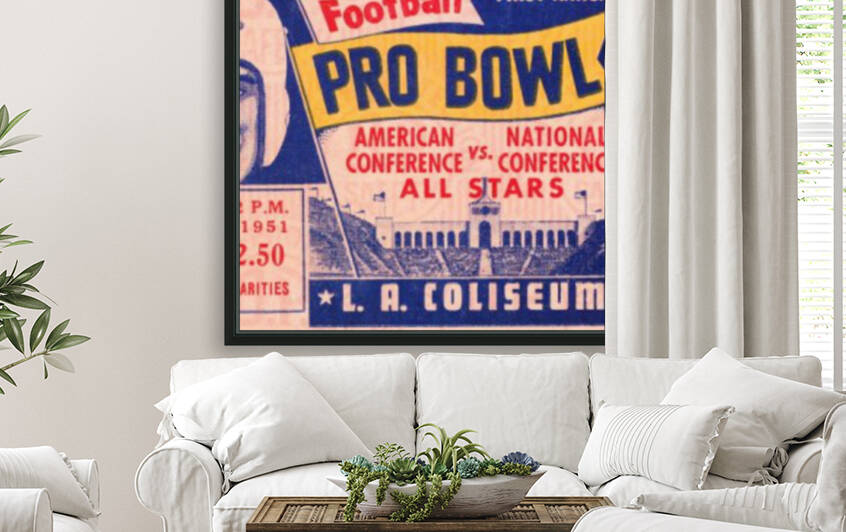
Locate an element on the screen. This screenshot has width=846, height=532. curtain is located at coordinates (629, 161).